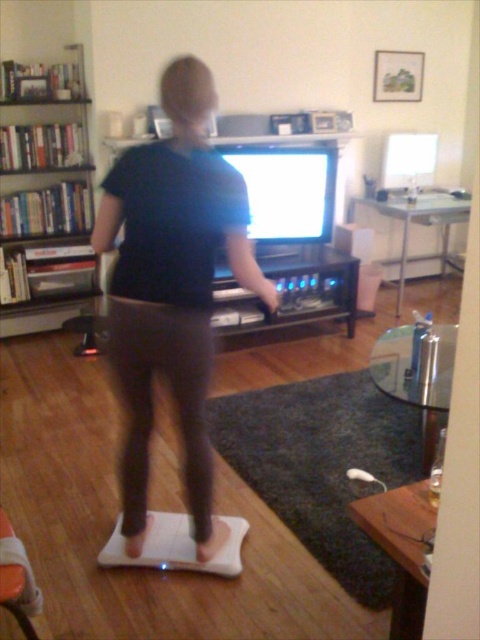
Looking at this image, between white rubber mat at lower center and black wood entertainment center at center, which one is positioned lower?

white rubber mat at lower center is below.

The image size is (480, 640). Describe the element at coordinates (326, 464) in the screenshot. I see `white rubber mat at lower center` at that location.

Where is `white rubber mat at lower center`? white rubber mat at lower center is located at coordinates coord(326,464).

Between wooden bookshelf at left and black wood entertainment center at center, which one is positioned higher?

Positioned higher is wooden bookshelf at left.

Identify the location of wooden bookshelf at left. (45, 196).

Does black matte shirt at center appear over white rubber mat at lower center?

Indeed, black matte shirt at center is positioned over white rubber mat at lower center.

Who is shorter, black matte shirt at center or white rubber mat at lower center?

With less height is white rubber mat at lower center.

What do you see at coordinates (171, 289) in the screenshot? I see `black matte shirt at center` at bounding box center [171, 289].

You are a GUI agent. You are given a task and a screenshot of the screen. Output one action in this format:
    pyautogui.click(x=<x>, y=<y>)
    Task: Click on the black matte shirt at center
    This screenshot has height=640, width=480.
    Given the screenshot: What is the action you would take?
    pyautogui.click(x=171, y=289)